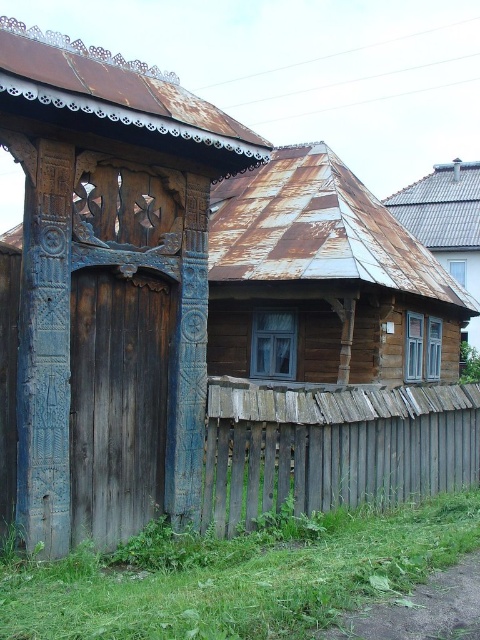
Question: Which of the following is the farthest from the observer?

Choices:
 (A) (465, 186)
 (B) (407, 464)

Answer: (A)

Question: Is blue wood log cabin at left below weathered wood fence at center?

Choices:
 (A) yes
 (B) no

Answer: (B)

Question: Is blue wood log cabin at left below weathered wood fence at center?

Choices:
 (A) no
 (B) yes

Answer: (A)

Question: Considering the relative positions of blue wood log cabin at left and rusty metal roof at upper right in the image provided, where is blue wood log cabin at left located with respect to rusty metal roof at upper right?

Choices:
 (A) below
 (B) above

Answer: (A)

Question: Which object appears closest to the camera in this image?

Choices:
 (A) blue wood log cabin at left
 (B) weathered wood fence at center
 (C) rusty metal roof at upper right

Answer: (A)

Question: Which of the following is the closest to the observer?

Choices:
 (A) rusty metal roof at upper right
 (B) weathered wood fence at center
 (C) blue wood log cabin at left

Answer: (C)